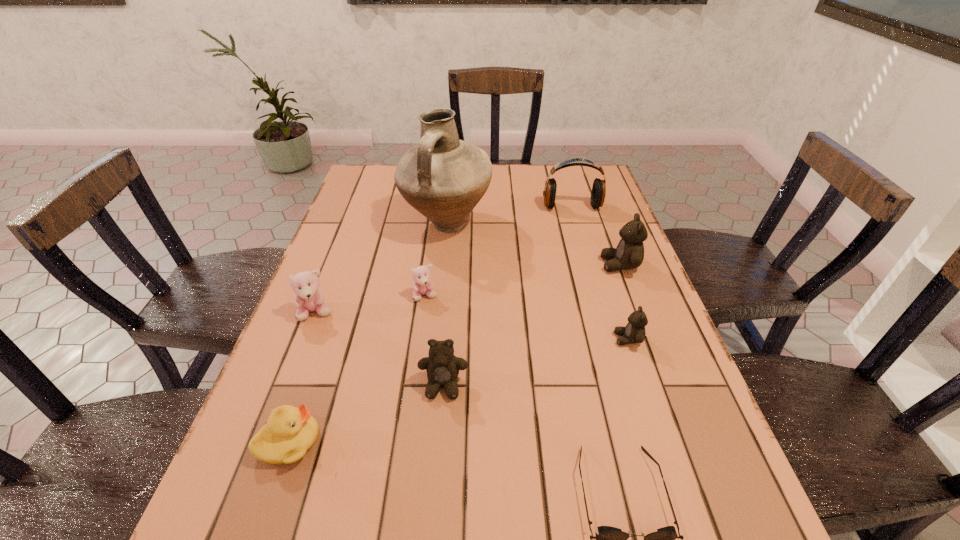
I want to click on the tallest object, so click(x=443, y=178).

Identify the location of headset. (598, 193).

This screenshot has height=540, width=960. Find the location of `the tallest teddy bear`. the tallest teddy bear is located at coordinates (629, 254).

Find the location of a particular element. This screenshot has width=960, height=540. the biggest brown teddy bear is located at coordinates (629, 254).

I want to click on the second smallest brown teddy bear, so click(x=442, y=366).

Find the location of a particular element. This screenshot has height=540, width=960. the nearest brown teddy bear is located at coordinates (442, 366).

The height and width of the screenshot is (540, 960). I want to click on the leftmost teddy bear, so click(x=309, y=297).

The image size is (960, 540). What are the coordinates of `the bigger pink teddy bear` in the screenshot? It's located at (309, 297).

This screenshot has height=540, width=960. I want to click on the second nearest brown teddy bear, so click(634, 332).

Identify the location of the sixth farthest object. Image resolution: width=960 pixels, height=540 pixels. pyautogui.click(x=634, y=332).